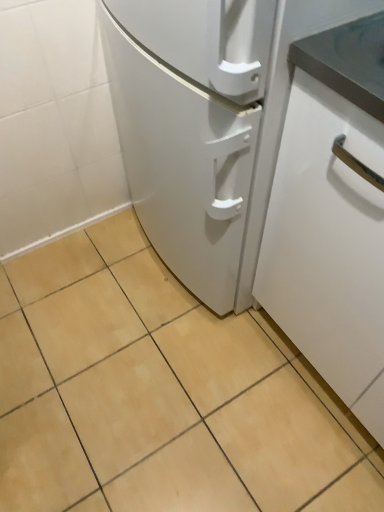
Measure the distance between white matte cabinet at right and camera.

white matte cabinet at right and camera are 23.96 inches apart.

Find the location of a particular element. This screenshot has height=512, width=384. white matte cabinet at right is located at coordinates (329, 246).

The image size is (384, 512). What do you see at coordinates (329, 246) in the screenshot?
I see `white matte cabinet at right` at bounding box center [329, 246].

Describe the element at coordinates (160, 394) in the screenshot. The height and width of the screenshot is (512, 384). I see `beige ceramic tile at center` at that location.

Locate an element on the screen. beige ceramic tile at center is located at coordinates (160, 394).

Identify the location of white matte cabinet at right. The width and height of the screenshot is (384, 512). (329, 246).

Considering the positions of objects white matte cabinet at right and beige ceramic tile at center in the image provided, who is more to the left, white matte cabinet at right or beige ceramic tile at center?

beige ceramic tile at center is more to the left.

Which object is more forward, white matte cabinet at right or beige ceramic tile at center?

Positioned in front is white matte cabinet at right.

Considering the points (359, 345) and (67, 345), which point is in front, point (359, 345) or point (67, 345)?

The point (359, 345) is closer.

From the image's perspective, between white matte cabinet at right and beige ceramic tile at center, who is located below?

beige ceramic tile at center is shown below in the image.

From a real-world perspective, which is physically above, white matte cabinet at right or beige ceramic tile at center?

In real-world perspective, white matte cabinet at right is above.

Is white matte cabinet at right wider than beige ceramic tile at center?

No, white matte cabinet at right is not wider than beige ceramic tile at center.

Does white matte cabinet at right have a lesser height compared to beige ceramic tile at center?

No, white matte cabinet at right is not shorter than beige ceramic tile at center.

Is white matte cabinet at right smaller than beige ceramic tile at center?

Actually, white matte cabinet at right might be larger than beige ceramic tile at center.

Which is correct: white matte cabinet at right is inside beige ceramic tile at center, or outside of it?

white matte cabinet at right is spatially situated outside beige ceramic tile at center.

Is white matte cabinet at right beside beige ceramic tile at center?

No, white matte cabinet at right is not touching beige ceramic tile at center.

Is white matte cabinet at right facing towards beige ceramic tile at center?

Yes, white matte cabinet at right is turned towards beige ceramic tile at center.

How many degrees apart are the facing directions of white matte cabinet at right and beige ceramic tile at center?

The angle between the facing direction of white matte cabinet at right and the facing direction of beige ceramic tile at center is 0.153 degrees.

How distant is white matte cabinet at right from beige ceramic tile at center?

white matte cabinet at right and beige ceramic tile at center are 18.65 inches apart.

Find the location of a particular element. This screenshot has height=512, width=384. ceramic tile that appears below the white matte cabinet at right (from the image's perspective) is located at coordinates (160, 394).

Which object is positioned more to the left, beige ceramic tile at center or white matte cabinet at right?

From the viewer's perspective, beige ceramic tile at center appears more on the left side.

Considering the positions of objects beige ceramic tile at center and white matte cabinet at right in the image provided, who is behind, beige ceramic tile at center or white matte cabinet at right?

beige ceramic tile at center is behind.

Considering the positions of point (308, 385) and point (310, 329), is point (308, 385) closer or farther from the camera than point (310, 329)?

Clearly, point (308, 385) is more distant from the camera than point (310, 329).

From the image's perspective, which one is positioned lower, beige ceramic tile at center or white matte cabinet at right?

From the image's view, beige ceramic tile at center is below.

From a real-world perspective, is beige ceramic tile at center over white matte cabinet at right?

No.

Considering the sizes of objects beige ceramic tile at center and white matte cabinet at right in the image provided, who is wider, beige ceramic tile at center or white matte cabinet at right?

beige ceramic tile at center.

Does beige ceramic tile at center have a lesser height compared to white matte cabinet at right?

Yes.

Considering the relative sizes of beige ceramic tile at center and white matte cabinet at right in the image provided, is beige ceramic tile at center smaller than white matte cabinet at right?

Yes.

In the scene shown: Choose the correct answer: Is beige ceramic tile at center inside white matte cabinet at right or outside it?

beige ceramic tile at center is located beyond the bounds of white matte cabinet at right.

Are beige ceramic tile at center and white matte cabinet at right far apart?

beige ceramic tile at center is actually quite close to white matte cabinet at right.

Is beige ceramic tile at center facing towards white matte cabinet at right?

No, beige ceramic tile at center does not turn towards white matte cabinet at right.

How much distance is there between beige ceramic tile at center and white matte cabinet at right?

beige ceramic tile at center and white matte cabinet at right are 18.65 inches apart from each other.

What are the coordinates of `ceramic tile located behind the white matte cabinet at right` in the screenshot? It's located at (160, 394).

Locate an element on the screen. cabinetry above the beige ceramic tile at center (from the image's perspective) is located at coordinates (329, 246).

Locate an element on the screen. cabinetry that is above the beige ceramic tile at center (from a real-world perspective) is located at coordinates (329, 246).